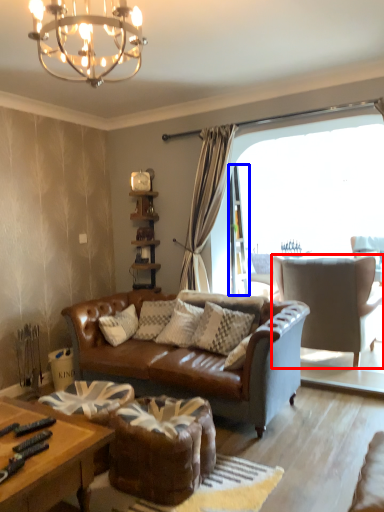
Question: Which object is closer to the camera taking this photo, chair (highlighted by a red box) or screen door (highlighted by a blue box)?

Choices:
 (A) chair
 (B) screen door

Answer: (A)